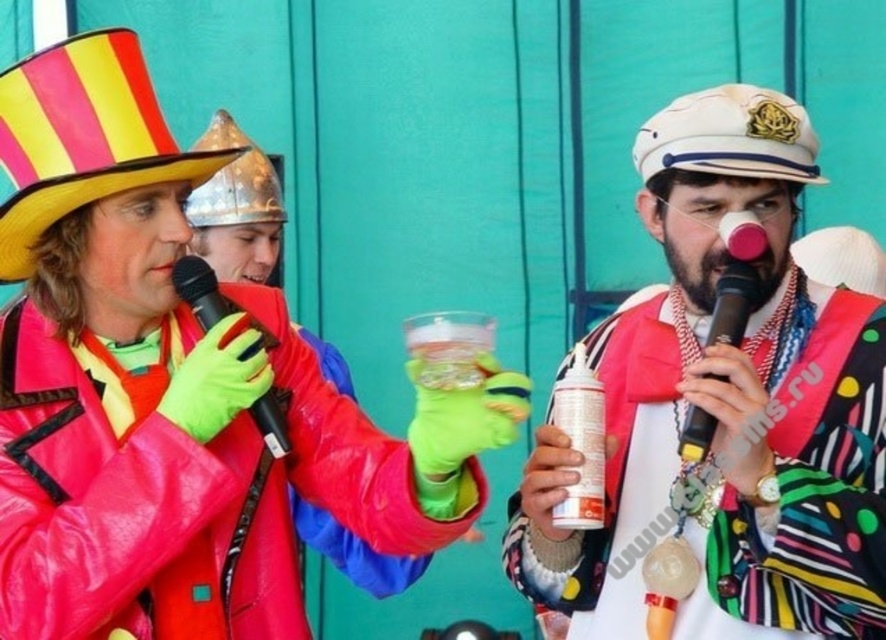
You are a costume designer observing the image. You need to determine which object is higher in position between the polka dot fabric scarf at center and the black matte microphone at center. Which one is taller?

The polka dot fabric scarf at center is taller than the black matte microphone at center.